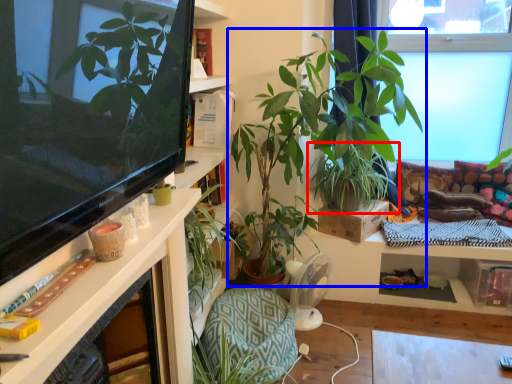
Question: Which object appears farthest to the camera in this image, houseplant (highlighted by a red box) or houseplant (highlighted by a blue box)?

Choices:
 (A) houseplant
 (B) houseplant

Answer: (A)